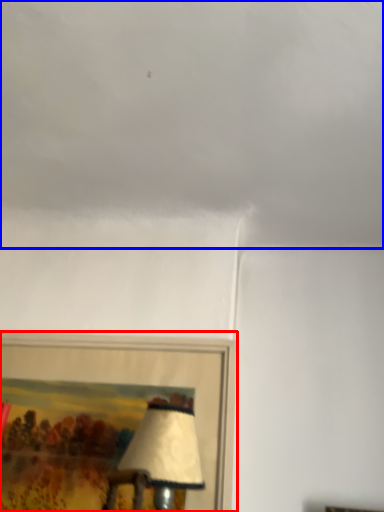
Question: Among these objects, which one is nearest to the camera, picture frame (highlighted by a red box) or cloud (highlighted by a blue box)?

Choices:
 (A) picture frame
 (B) cloud

Answer: (B)